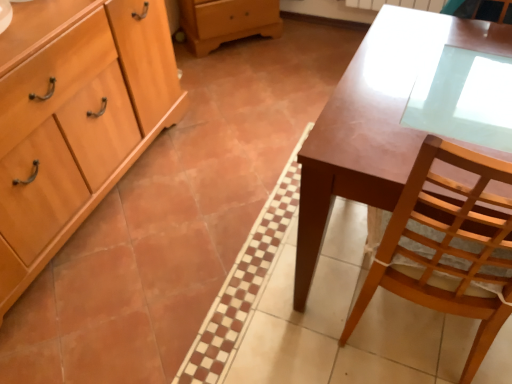
At what (x,y) coordinates should I click in order to perform the action: click on free space to the right of light wood cabinet at left. Please return your answer as a coordinate pair (x, y). Image resolution: width=512 pixels, height=384 pixels. Looking at the image, I should click on (221, 174).